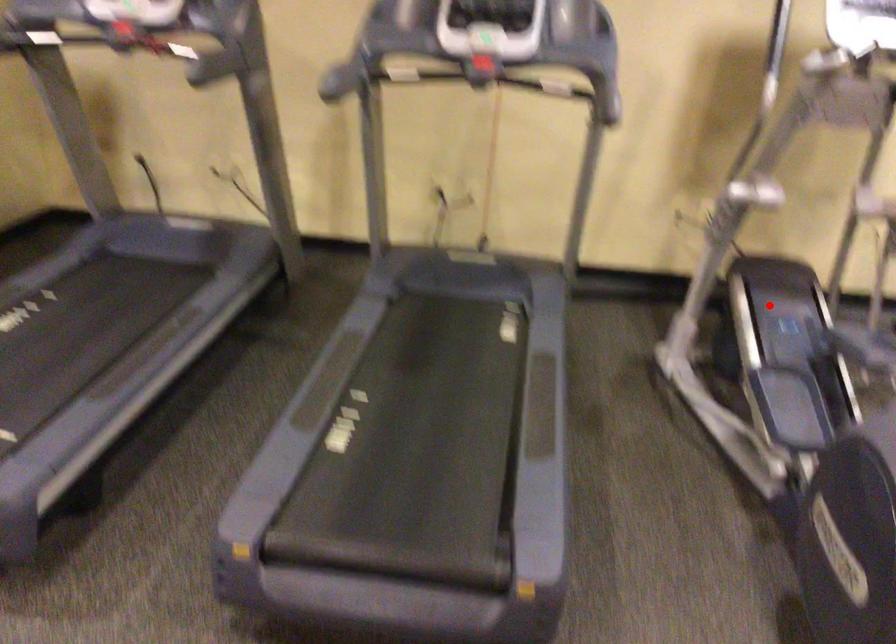
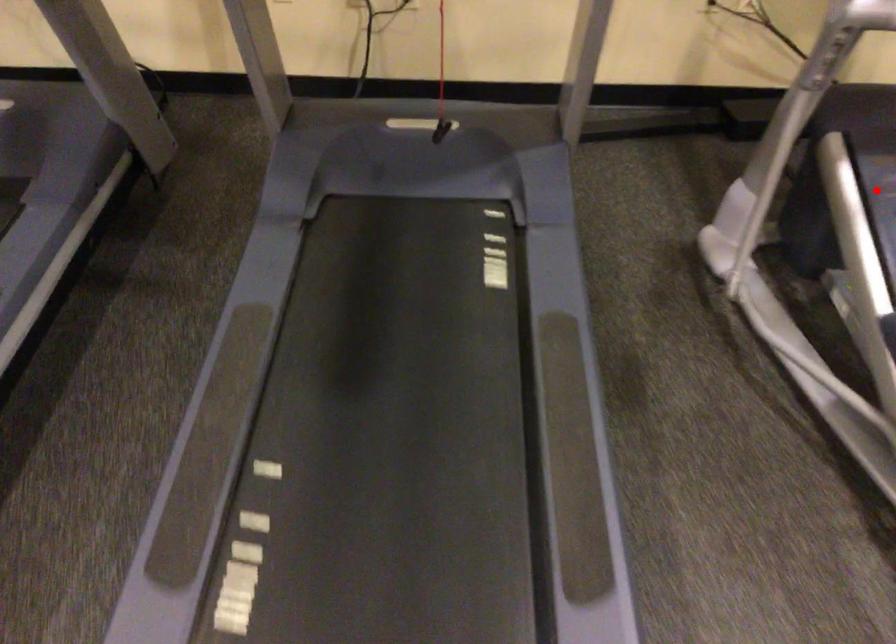
I am providing you with two images of the same scene from different viewpoints. A red point is marked on the first image and another point is marked on the second image. Do the highlighted points in image1 and image2 indicate the same real-world spot?

Yes